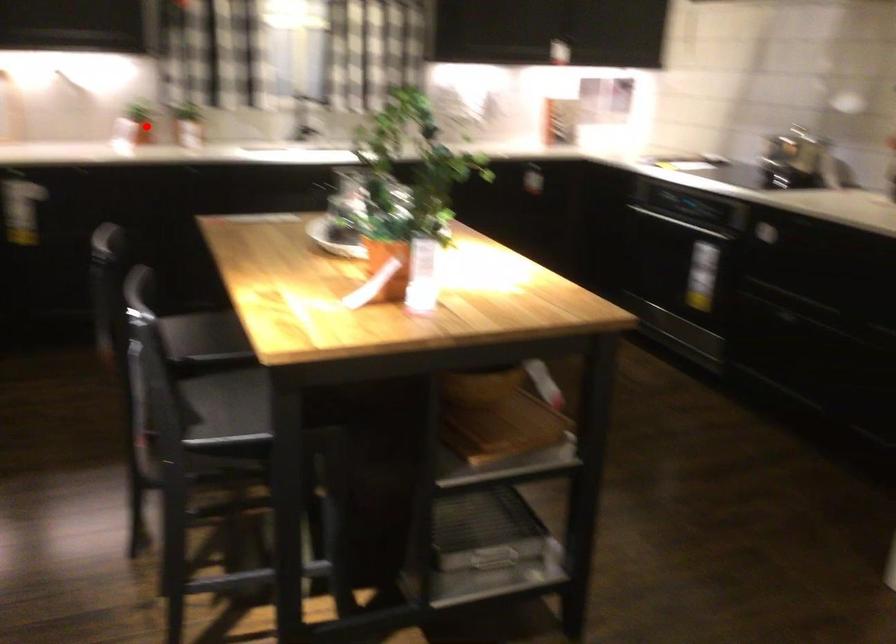
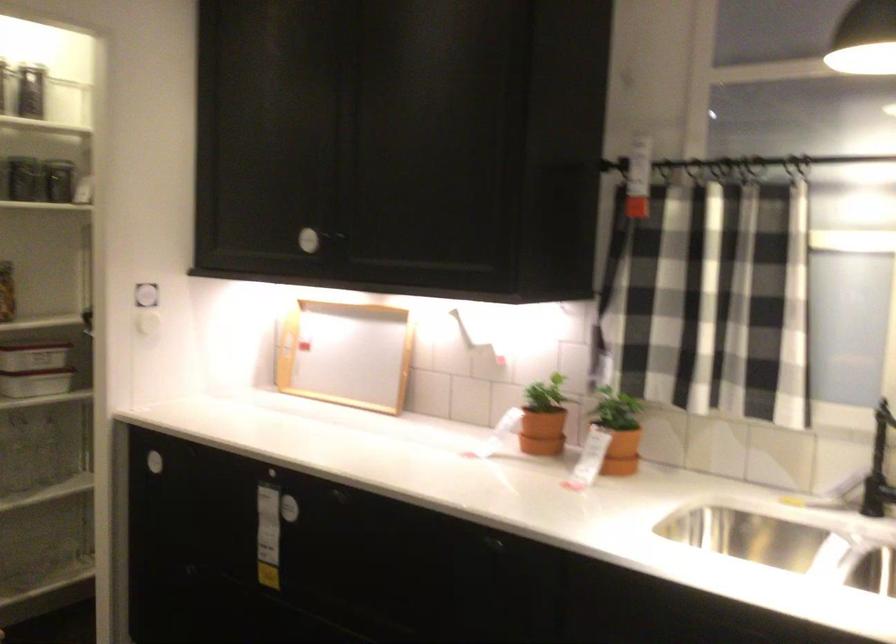
Find the pixel in the second image that matches the highlighted location in the first image.

(541, 431)